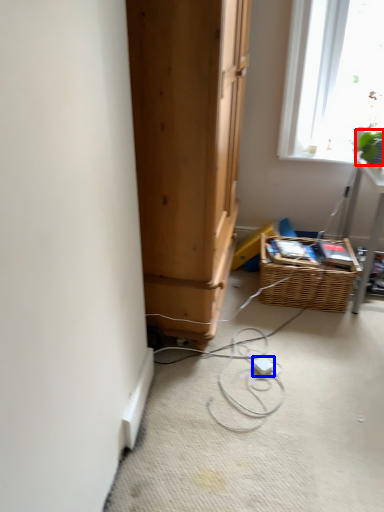
Question: Among these objects, which one is farthest to the camera, plant (highlighted by a red box) or extension cord (highlighted by a blue box)?

Choices:
 (A) plant
 (B) extension cord

Answer: (A)